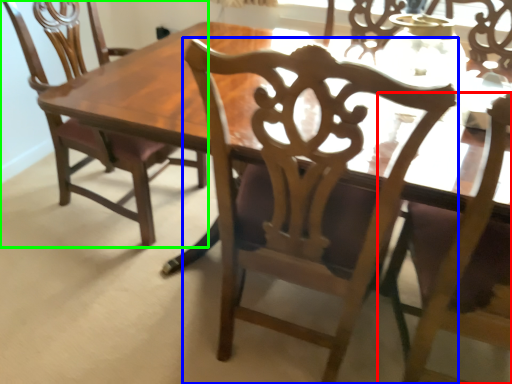
Question: Estimate the real-world distances between objects in this image. Which object is closer to chair (highlighted by a red box), chair (highlighted by a blue box) or chair (highlighted by a green box)?

Choices:
 (A) chair
 (B) chair

Answer: (A)